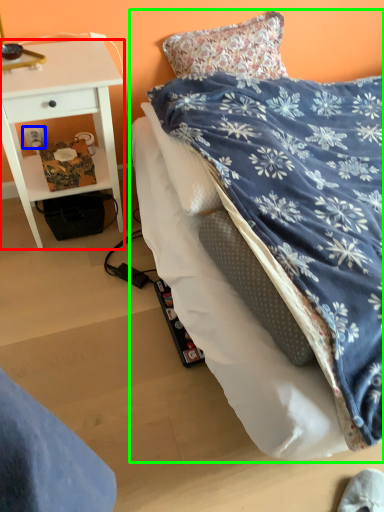
Question: Which object is the farthest from desk (highlighted by a red box)? Choose among these: power outlet (highlighted by a blue box) or bed (highlighted by a green box).

Choices:
 (A) power outlet
 (B) bed

Answer: (B)